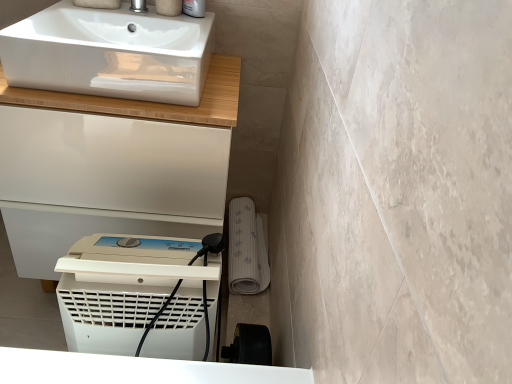
Find the location of a particular element. The image size is (512, 384). satin nickel faucet at upper center is located at coordinates (138, 6).

From the picture: Is white plastic dehumidifier at lower center looking in the opposite direction of satin nickel faucet at upper center?

No, white plastic dehumidifier at lower center is not facing away from satin nickel faucet at upper center.

Is white plastic dehumidifier at lower center positioned beyond the bounds of satin nickel faucet at upper center?

Absolutely, white plastic dehumidifier at lower center is external to satin nickel faucet at upper center.

Which point is more forward, (x=154, y=325) or (x=140, y=1)?

The point (x=154, y=325) is more forward.

In the scene shown: How many degrees apart are the facing directions of white plastic dehumidifier at lower center and satin nickel faucet at upper center?

The angle between the facing direction of white plastic dehumidifier at lower center and the facing direction of satin nickel faucet at upper center is 0.765 degrees.

Looking at this image, does white glossy sink at upper left appear on the right side of white plastic dehumidifier at lower center?

Incorrect, white glossy sink at upper left is not on the right side of white plastic dehumidifier at lower center.

Based on the photo, considering the relative positions of white glossy sink at upper left and white plastic dehumidifier at lower center in the image provided, is white glossy sink at upper left behind white plastic dehumidifier at lower center?

Yes, the depth of white glossy sink at upper left is greater than that of white plastic dehumidifier at lower center.

Who is shorter, white glossy sink at upper left or white plastic dehumidifier at lower center?

white glossy sink at upper left.

Does white glossy cabinet at upper left come in front of white glossy sink at upper left?

No, white glossy cabinet at upper left is behind white glossy sink at upper left.

Which of these two, white glossy cabinet at upper left or white glossy sink at upper left, stands taller?

With more height is white glossy cabinet at upper left.

Does white glossy cabinet at upper left appear on the right side of white glossy sink at upper left?

No.

Does white glossy cabinet at upper left turn towards white glossy sink at upper left?

No, white glossy cabinet at upper left does not turn towards white glossy sink at upper left.

Considering the sizes of white glossy sink at upper left and white glossy cabinet at upper left in the image, is white glossy sink at upper left taller or shorter than white glossy cabinet at upper left?

white glossy sink at upper left is shorter than white glossy cabinet at upper left.

Locate an element on the screen. The image size is (512, 384). sink lying on the right of white glossy cabinet at upper left is located at coordinates (110, 53).

From a real-world perspective, which is physically below, white glossy sink at upper left or white glossy cabinet at upper left?

white glossy cabinet at upper left, from a real-world perspective.

Is white glossy sink at upper left facing away from white glossy cabinet at upper left?

That's not correct — white glossy sink at upper left is not looking away from white glossy cabinet at upper left.

Does point (182, 266) come behind point (220, 68)?

No, (182, 266) is closer to viewer.

From a real-world perspective, which object rests below the other?

white plastic dehumidifier at lower center, from a real-world perspective.

In order to click on home appliance lying in front of the white glossy cabinet at upper left in this screenshot , I will do point(138,296).

Is there a large distance between white glossy cabinet at upper left and white plastic dehumidifier at lower center?

That's not correct — white glossy cabinet at upper left is a little close to white plastic dehumidifier at lower center.

From a real-world perspective, who is located higher, white glossy cabinet at upper left or white plastic dehumidifier at lower center?

In real-world perspective, white glossy cabinet at upper left is above.

From a real-world perspective, is satin nickel faucet at upper center on white plastic dehumidifier at lower center?

Yes, from a real-world perspective, satin nickel faucet at upper center is on top of white plastic dehumidifier at lower center.

Based on the photo, looking at the image, does satin nickel faucet at upper center seem bigger or smaller compared to white plastic dehumidifier at lower center?

Considering their sizes, satin nickel faucet at upper center takes up less space than white plastic dehumidifier at lower center.

Based on their positions, is satin nickel faucet at upper center located to the left or right of white plastic dehumidifier at lower center?

Based on their positions, satin nickel faucet at upper center is located to the left of white plastic dehumidifier at lower center.

Can you confirm if satin nickel faucet at upper center is taller than white plastic dehumidifier at lower center?

No, satin nickel faucet at upper center is not taller than white plastic dehumidifier at lower center.

Image resolution: width=512 pixels, height=384 pixels. Find the location of `tap located above the white plastic dehumidifier at lower center (from a real-world perspective)`. tap located above the white plastic dehumidifier at lower center (from a real-world perspective) is located at coordinates (138, 6).

Identify the location of home appliance that appears in front of the white glossy sink at upper left. (138, 296).

Based on their spatial positions, is satin nickel faucet at upper center or white glossy cabinet at upper left closer to white plastic dehumidifier at lower center?

white glossy cabinet at upper left lies closer to white plastic dehumidifier at lower center than the other object.

Based on their spatial positions, is white glossy sink at upper left or white glossy cabinet at upper left further from white plastic dehumidifier at lower center?

The object further to white plastic dehumidifier at lower center is white glossy sink at upper left.

Based on their spatial positions, is white plastic dehumidifier at lower center or satin nickel faucet at upper center closer to white glossy sink at upper left?

Based on the image, satin nickel faucet at upper center appears to be nearer to white glossy sink at upper left.

From the image, which object appears to be nearer to white plastic dehumidifier at lower center, white glossy cabinet at upper left or satin nickel faucet at upper center?

white glossy cabinet at upper left lies closer to white plastic dehumidifier at lower center than the other object.

Based on their spatial positions, is white glossy cabinet at upper left or white plastic dehumidifier at lower center closer to white glossy sink at upper left?

white glossy cabinet at upper left is positioned closer to the anchor white glossy sink at upper left.

Considering their positions, is white glossy cabinet at upper left positioned closer to white plastic dehumidifier at lower center than white glossy sink at upper left?

white glossy cabinet at upper left lies closer to white plastic dehumidifier at lower center than the other object.

Which object lies further to the anchor point white glossy sink at upper left, satin nickel faucet at upper center or white plastic dehumidifier at lower center?

The object further to white glossy sink at upper left is white plastic dehumidifier at lower center.

Estimate the real-world distances between objects in this image. Which object is closer to white glossy cabinet at upper left, white glossy sink at upper left or white plastic dehumidifier at lower center?

white glossy sink at upper left is positioned closer to the anchor white glossy cabinet at upper left.

Locate an element on the screen. This screenshot has height=384, width=512. sink between satin nickel faucet at upper center and white plastic dehumidifier at lower center from top to bottom is located at coordinates (110, 53).

Identify the location of bathroom cabinet between satin nickel faucet at upper center and white plastic dehumidifier at lower center in the vertical direction. (147, 102).

The image size is (512, 384). Find the location of `bathroom cabinet that lies between white glossy sink at upper left and white plastic dehumidifier at lower center from top to bottom`. bathroom cabinet that lies between white glossy sink at upper left and white plastic dehumidifier at lower center from top to bottom is located at coordinates (147, 102).

Where is `sink that lies between satin nickel faucet at upper center and white glossy cabinet at upper left from top to bottom`? The width and height of the screenshot is (512, 384). sink that lies between satin nickel faucet at upper center and white glossy cabinet at upper left from top to bottom is located at coordinates (110, 53).